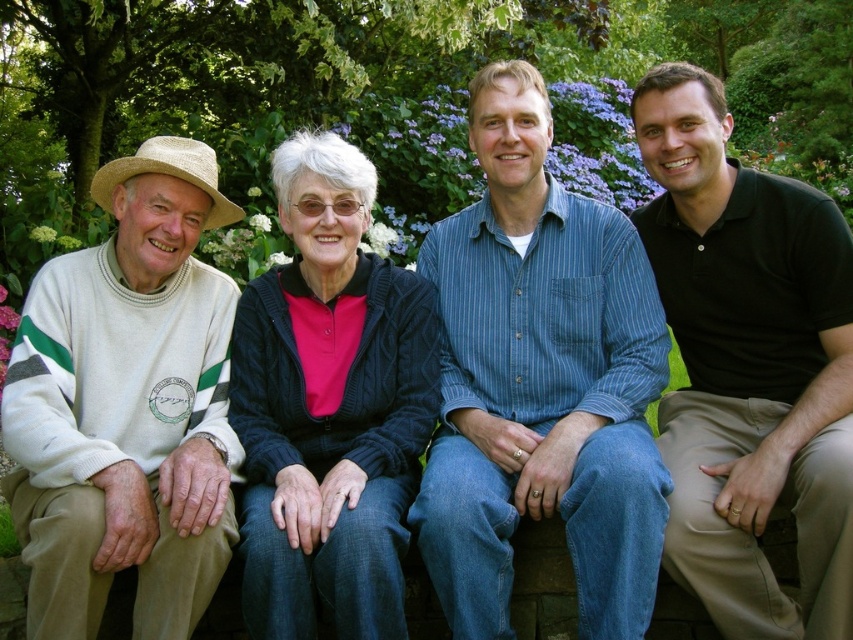
You are standing in the garden and see the white knit sweater at left and the green striped sweater at center. Which sweater is closer to the purple flowers in the background?

The white knit sweater at left is closer to the purple flowers in the background because it is located at point (126, 406) which is closer to the background than the green striped sweater at center.

Based on the coordinates provided, which object is located at point (126,406) in the image?

The point (126,406) indicates the white knit sweater at left.